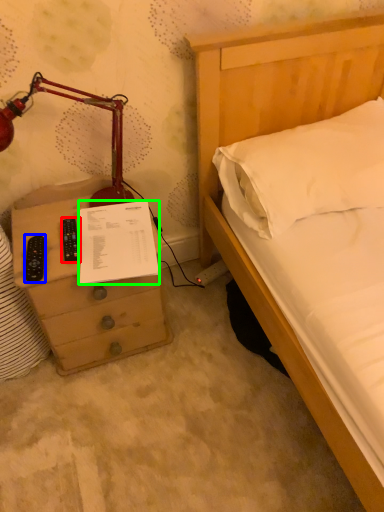
Question: Estimate the real-world distances between objects in this image. Which object is farther from control (highlighted by a red box), remote (highlighted by a blue box) or document (highlighted by a green box)?

Choices:
 (A) remote
 (B) document

Answer: (B)